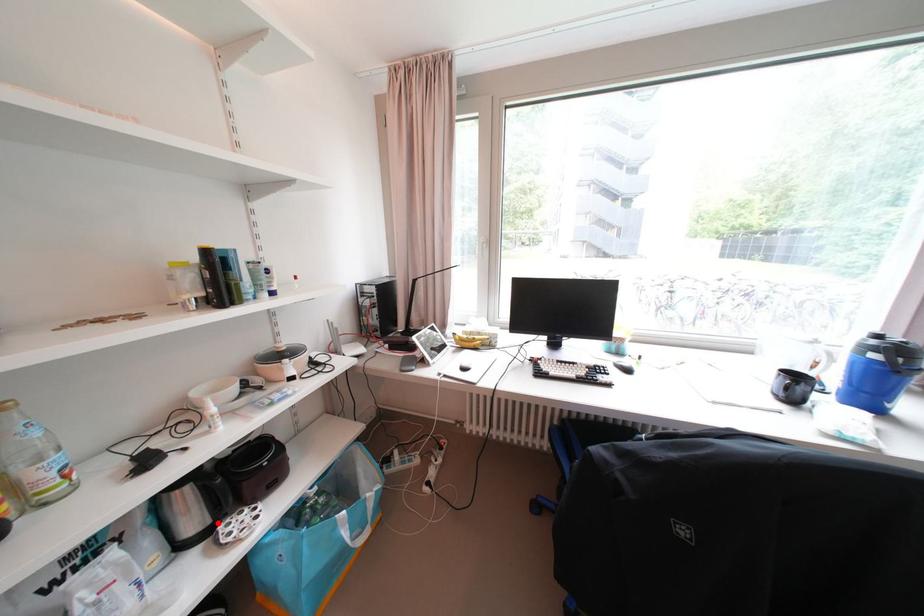
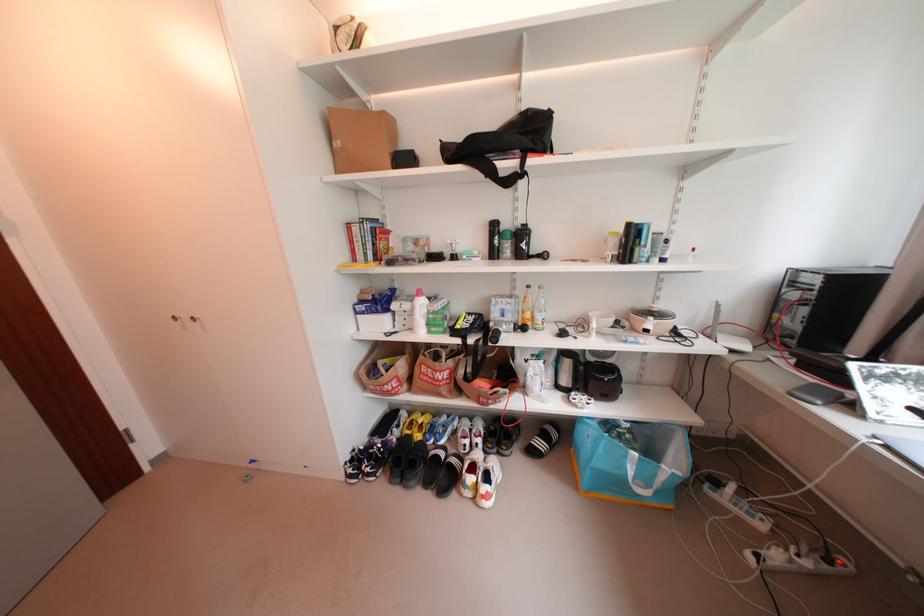
Question: I am providing you with two images of the same scene from different viewpoints. Given a red point in image1, look at the same physical point in image2. Is it:

Choices:
 (A) Closer to the viewpoint
 (B) Farther from the viewpoint

Answer: (B)